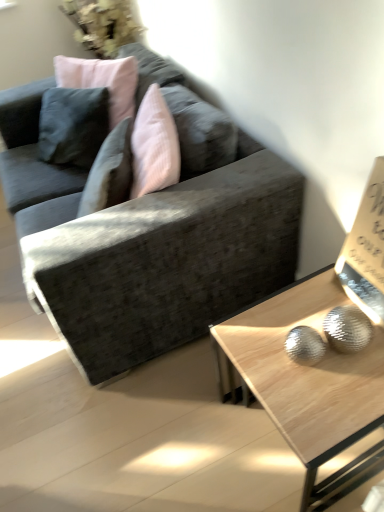
The height and width of the screenshot is (512, 384). Identify the location of light wood/texture coffee table at lower right. (310, 383).

The height and width of the screenshot is (512, 384). Describe the element at coordinates (310, 383) in the screenshot. I see `light wood/texture coffee table at lower right` at that location.

At what (x,y) coordinates should I click in order to perform the action: click on white paper at upper right. Please return your answer as a coordinate pair (x, y). This screenshot has width=384, height=512. Looking at the image, I should click on (366, 250).

At what (x,y) coordinates should I click in order to perform the action: click on light wood/texture coffee table at lower right. Please return your answer as a coordinate pair (x, y). Looking at the image, I should click on (310, 383).

Is point (65, 195) closer or farther from the camera than point (291, 421)?

Point (65, 195) is positioned farther from the camera compared to point (291, 421).

Which is behind, textured gray couch at center or light wood/texture coffee table at lower right?

textured gray couch at center.

Is textured gray couch at center wider or thinner than light wood/texture coffee table at lower right?

In the image, textured gray couch at center appears to be wider than light wood/texture coffee table at lower right.

At what (x,y) coordinates should I click in order to perform the action: click on coffee table in front of the textured gray couch at center. Please return your answer as a coordinate pair (x, y). Image resolution: width=384 pixels, height=512 pixels. Looking at the image, I should click on (310, 383).

Considering the sizes of light wood/texture coffee table at lower right and textured gray couch at center in the image, is light wood/texture coffee table at lower right bigger or smaller than textured gray couch at center?

light wood/texture coffee table at lower right is smaller than textured gray couch at center.

Which is behind, light wood/texture coffee table at lower right or textured gray couch at center?

textured gray couch at center is further away from the camera.

From a real-world perspective, which object stands above the other?

textured gray couch at center.

Based on their positions, is white paper at upper right located to the left or right of textured gray couch at center?

Based on their positions, white paper at upper right is located to the right of textured gray couch at center.

From a real-world perspective, is white paper at upper right physically located above or below textured gray couch at center?

From a real-world perspective, white paper at upper right is physically above textured gray couch at center.

Is white paper at upper right next to textured gray couch at center and touching it?

No, white paper at upper right is not next to textured gray couch at center.

This screenshot has height=512, width=384. Find the location of `paperback book in front of the textured gray couch at center`. paperback book in front of the textured gray couch at center is located at coordinates (366, 250).

In the scene shown: Is white paper at upper right located within light wood/texture coffee table at lower right?

Definitely not — white paper at upper right is not inside light wood/texture coffee table at lower right.

Does light wood/texture coffee table at lower right appear on the left side of white paper at upper right?

Yes.

From the image's perspective, between light wood/texture coffee table at lower right and white paper at upper right, which one is located above?

From the image's view, white paper at upper right is above.

Where is `paperback book on the right of the light wood/texture coffee table at lower right`? This screenshot has height=512, width=384. paperback book on the right of the light wood/texture coffee table at lower right is located at coordinates (366, 250).

Is textured gray couch at center taller or shorter than white paper at upper right?

textured gray couch at center is taller than white paper at upper right.

Considering the sizes of objects textured gray couch at center and white paper at upper right in the image provided, who is wider, textured gray couch at center or white paper at upper right?

textured gray couch at center.

Choose the correct answer: Is textured gray couch at center inside white paper at upper right or outside it?

→ textured gray couch at center exists outside the volume of white paper at upper right.

What's the angular difference between textured gray couch at center and white paper at upper right's facing directions?

The angular difference between textured gray couch at center and white paper at upper right is 0.531 degrees.

Would you say white paper at upper right is inside or outside light wood/texture coffee table at lower right?

white paper at upper right is outside light wood/texture coffee table at lower right.

Is white paper at upper right turned away from light wood/texture coffee table at lower right?

No, white paper at upper right is not facing away from light wood/texture coffee table at lower right.

Does white paper at upper right appear on the right side of light wood/texture coffee table at lower right?

Yes.

Is white paper at upper right bigger or smaller than light wood/texture coffee table at lower right?

Considering their sizes, white paper at upper right takes up less space than light wood/texture coffee table at lower right.

At what (x,y) coordinates should I click in order to perform the action: click on studio couch above the light wood/texture coffee table at lower right (from a real-world perspective). Please return your answer as a coordinate pair (x, y). Looking at the image, I should click on (148, 239).

I want to click on coffee table in front of the textured gray couch at center, so click(x=310, y=383).

Looking at the image, which one is located further to textured gray couch at center, light wood/texture coffee table at lower right or white paper at upper right?

Among the two, white paper at upper right is located further to textured gray couch at center.

In the scene shown: Considering their positions, is white paper at upper right positioned further to light wood/texture coffee table at lower right than textured gray couch at center?

Among the two, textured gray couch at center is located further to light wood/texture coffee table at lower right.

Looking at the image, which one is located closer to white paper at upper right, light wood/texture coffee table at lower right or textured gray couch at center?

Based on the image, light wood/texture coffee table at lower right appears to be nearer to white paper at upper right.

From the image, which object appears to be nearer to light wood/texture coffee table at lower right, textured gray couch at center or white paper at upper right?

Among the two, white paper at upper right is located nearer to light wood/texture coffee table at lower right.

From the image, which object appears to be farther from white paper at upper right, textured gray couch at center or light wood/texture coffee table at lower right?

textured gray couch at center is positioned further to the anchor white paper at upper right.

Based on their spatial positions, is white paper at upper right or light wood/texture coffee table at lower right further from textured gray couch at center?

Among the two, white paper at upper right is located further to textured gray couch at center.

Where is `coffee table between textured gray couch at center and white paper at upper right in the horizontal direction`? coffee table between textured gray couch at center and white paper at upper right in the horizontal direction is located at coordinates (310, 383).